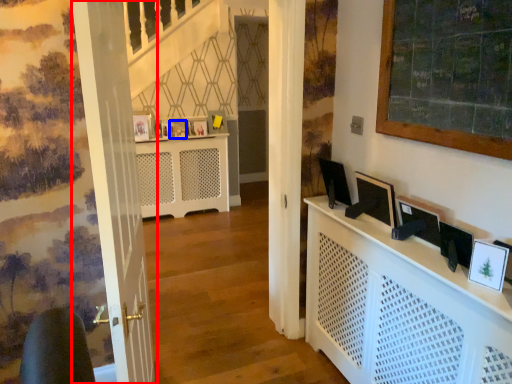
Question: Which object appears farthest to the camera in this image, door (highlighted by a red box) or picture frame (highlighted by a blue box)?

Choices:
 (A) door
 (B) picture frame

Answer: (B)